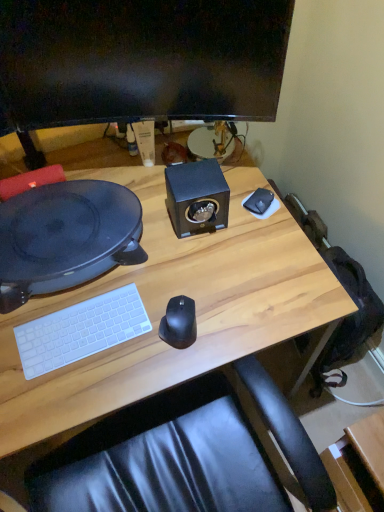
The image size is (384, 512). I want to click on vacant area that is situated to the right of white matte keyboard at lower left, so click(162, 324).